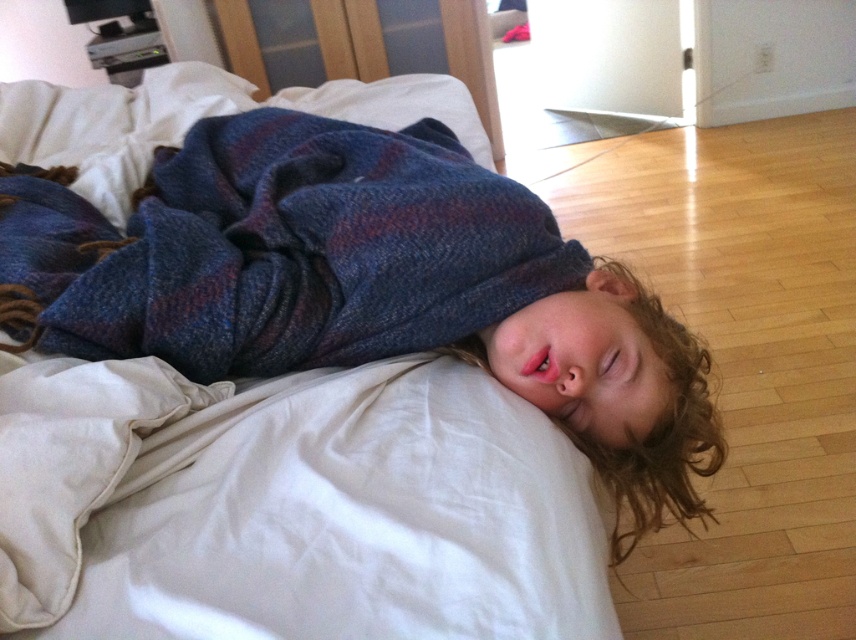
Consider the image. You are a photographer standing in the room where the child is sleeping. You want to take a photo of the point at coordinate point [223,378]. What is the minimum distance you need to move forward or backward to ensure the point is in focus?

The point at coordinate point [223,378] is 91.40 centimeters away from the camera. To ensure the point is in focus, you should position yourself so that the camera is exactly 91.40 centimeters away from the point.

Looking at this image, you are a parent checking on your child. You notice the blue woolen blanket at center and the plaid wool blanket at center. Can you tell if there is space between them?

Yes, there is a distance of 2.63 centimeters between the blue woolen blanket at center and the plaid wool blanket at center.

You are a parent who wants to check on your child. You are standing 30 inches away from the blue woolen blanket at center. Can you reach the blanket to adjust it without moving closer?

The blue woolen blanket at center and viewer are 32.50 inches apart from each other. Since you are standing 30 inches away, you are closer than the required distance, so you can reach the blanket to adjust it without moving closer.